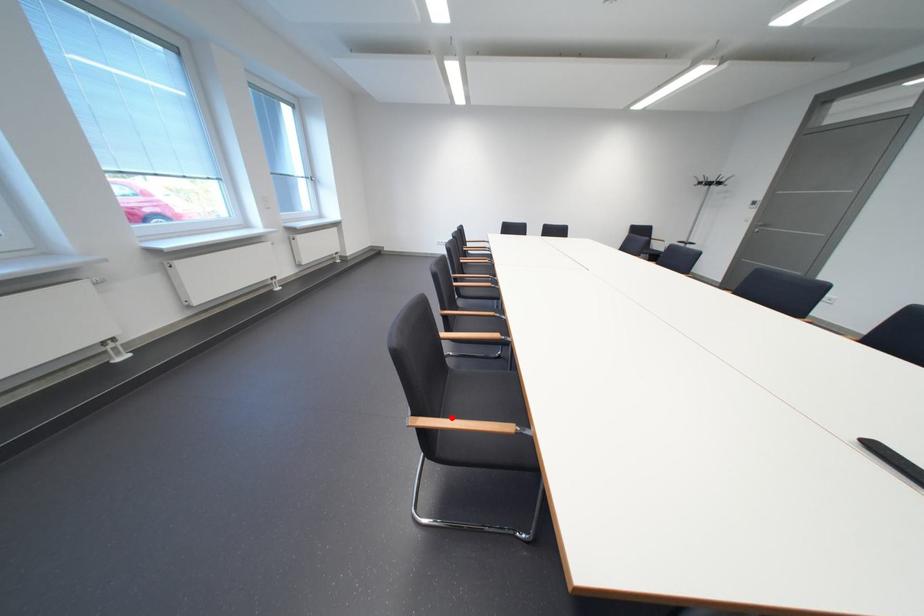
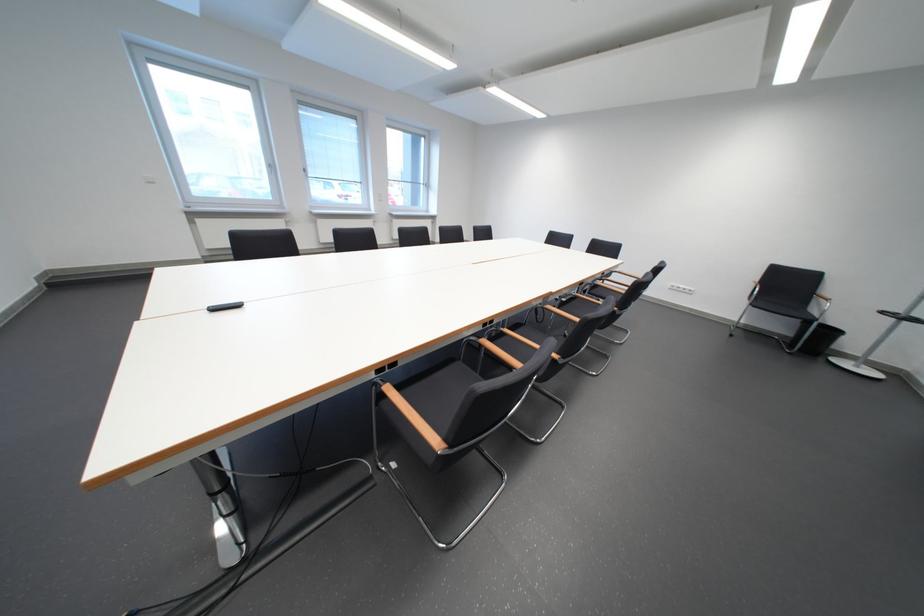
Question: I am providing you with two images of the same scene from different viewpoints. A red point is marked on the first image. Can you still see the location of the red point in image 2?

Choices:
 (A) Yes
 (B) No

Answer: (B)